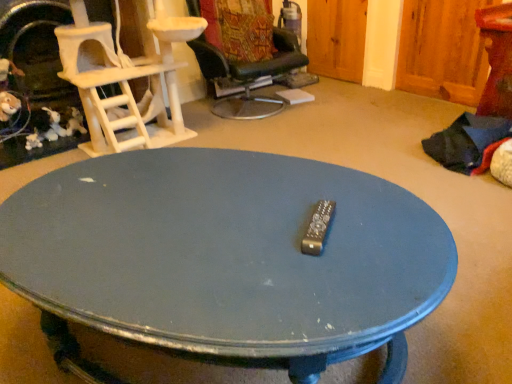
Question: Is blue painted wood coffee table at center inside or outside of black leather chair at upper center, which ranks as the second chair in left-to-right order?

Choices:
 (A) outside
 (B) inside

Answer: (A)

Question: From a real-world perspective, relative to black leather chair at upper center, which ranks as the second chair in left-to-right order, is blue painted wood coffee table at center vertically above or below?

Choices:
 (A) above
 (B) below

Answer: (B)

Question: Based on their relative distances, which object is nearer to the black leather chair at upper center, acting as the 1th chair starting from the right?

Choices:
 (A) white textured cat tree at left, arranged as the second chair when viewed from the right
 (B) blue painted wood coffee table at center

Answer: (A)

Question: Which is farther from the blue painted wood coffee table at center?

Choices:
 (A) white textured cat tree at left, positioned as the first chair in left-to-right order
 (B) black leather chair at upper center, acting as the 1th chair starting from the right

Answer: (B)